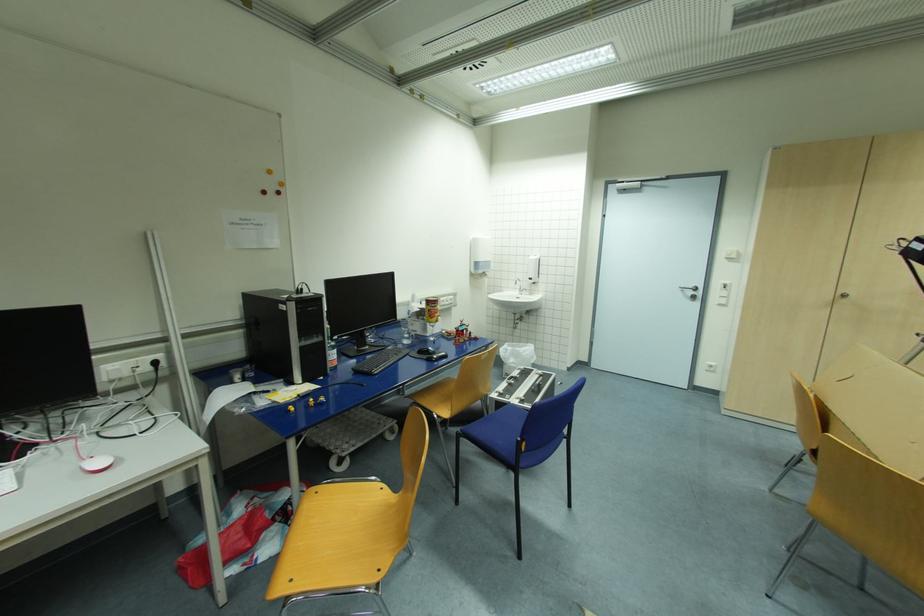
The width and height of the screenshot is (924, 616). In order to click on blue chair sitting surface in this screenshot , I will do `click(500, 424)`.